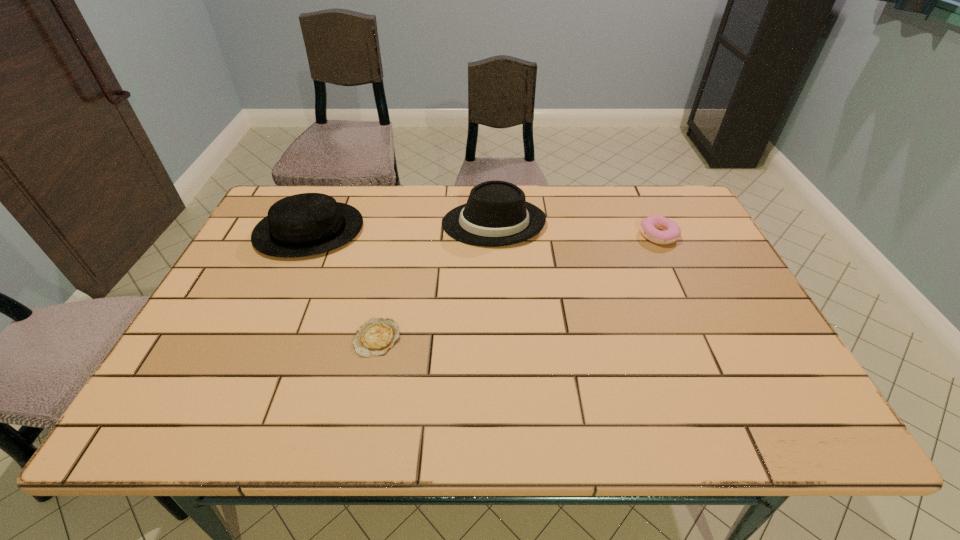
I want to click on vacant space at the near edge of the desktop, so click(672, 408).

The image size is (960, 540). In the image, there is a desktop. In order to click on free space at the left edge in this screenshot , I will do `click(177, 388)`.

Image resolution: width=960 pixels, height=540 pixels. In order to click on blank space at the right edge of the desktop in this screenshot , I will do `click(677, 285)`.

Locate an element on the screen. unoccupied position between the taller fedora and the quiche is located at coordinates click(x=436, y=281).

The height and width of the screenshot is (540, 960). Find the location of `free space between the quiche and the taller fedora`. free space between the quiche and the taller fedora is located at coordinates (436, 281).

Locate an element on the screen. Image resolution: width=960 pixels, height=540 pixels. empty location between the third shortest object and the right fedora is located at coordinates (401, 227).

The height and width of the screenshot is (540, 960). What are the coordinates of `vacant space in between the pastry and the tallest object` in the screenshot? It's located at (576, 230).

Locate an element on the screen. The height and width of the screenshot is (540, 960). empty location between the taller fedora and the leftmost object is located at coordinates (401, 227).

The image size is (960, 540). Identify the location of free area in between the shortest object and the pastry. (518, 287).

Identify the location of vacant space in between the third tallest object and the second object from right to left. The width and height of the screenshot is (960, 540). (576, 230).